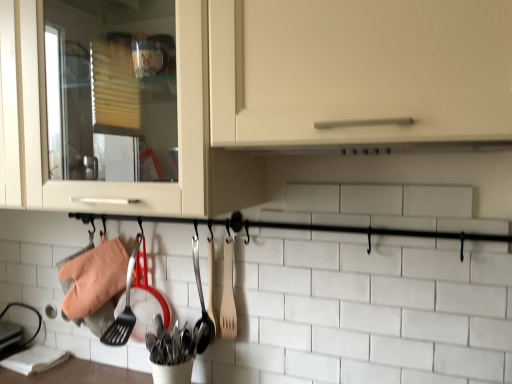
Question: Is wooden spatula at center at the left side of wooden spoon at center, which ranks as the first silverware in right-to-left order?

Choices:
 (A) no
 (B) yes

Answer: (A)

Question: Is wooden spatula at center not near wooden spoon at center, arranged as the 2th silverware when viewed from the left?

Choices:
 (A) no
 (B) yes

Answer: (A)

Question: Can you confirm if wooden spatula at center is taller than wooden spoon at center, arranged as the 2th silverware when viewed from the left?

Choices:
 (A) yes
 (B) no

Answer: (B)

Question: Is wooden spatula at center in front of wooden spoon at center, which ranks as the first silverware in right-to-left order?

Choices:
 (A) no
 (B) yes

Answer: (B)

Question: Is wooden spatula at center not within wooden spoon at center, which ranks as the first silverware in right-to-left order?

Choices:
 (A) no
 (B) yes

Answer: (B)

Question: From the image's perspective, would you say wooden spatula at center is positioned over wooden spoon at center, arranged as the 2th silverware when viewed from the left?

Choices:
 (A) yes
 (B) no

Answer: (A)

Question: Is matte white cabinet at center far away from polished stainless steel utensils at center, which ranks as the 2th silverware in right-to-left order?

Choices:
 (A) no
 (B) yes

Answer: (A)

Question: Are matte white cabinet at center and polished stainless steel utensils at center, which ranks as the 2th silverware in right-to-left order, making contact?

Choices:
 (A) yes
 (B) no

Answer: (B)

Question: Is matte white cabinet at center positioned beyond the bounds of polished stainless steel utensils at center, which ranks as the 2th silverware in right-to-left order?

Choices:
 (A) no
 (B) yes

Answer: (B)

Question: Is matte white cabinet at center further to the viewer compared to polished stainless steel utensils at center, arranged as the first silverware when viewed from the left?

Choices:
 (A) yes
 (B) no

Answer: (B)

Question: Does matte white cabinet at center have a larger size compared to polished stainless steel utensils at center, which ranks as the 2th silverware in right-to-left order?

Choices:
 (A) no
 (B) yes

Answer: (B)

Question: Can you confirm if matte white cabinet at center is wider than polished stainless steel utensils at center, arranged as the first silverware when viewed from the left?

Choices:
 (A) yes
 (B) no

Answer: (A)

Question: Can you see polished stainless steel utensils at center, arranged as the first silverware when viewed from the left, touching wooden spatula at center?

Choices:
 (A) no
 (B) yes

Answer: (A)